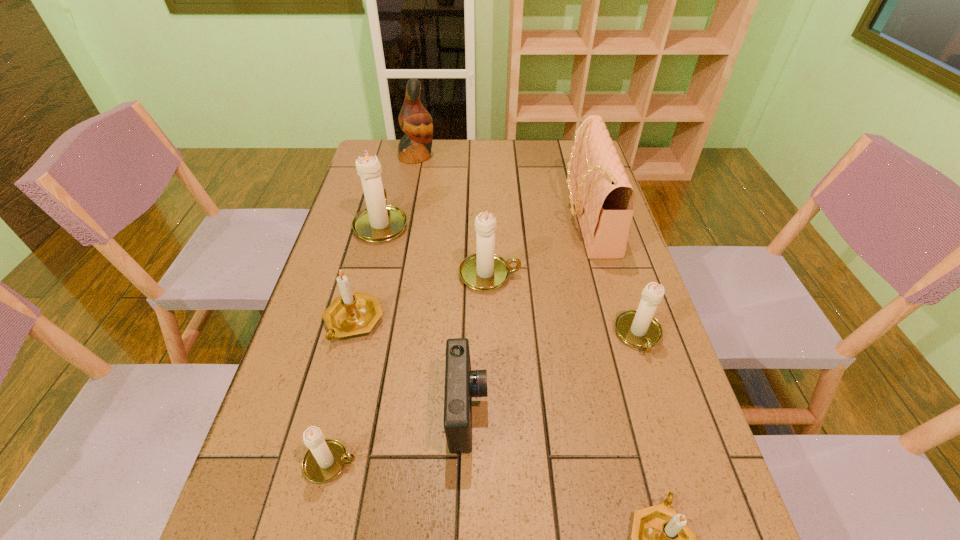
Find the location of a particular element. This screenshot has height=540, width=960. free region located on the front-facing side of the handbag is located at coordinates (497, 217).

Find the location of a particular element. The height and width of the screenshot is (540, 960). vacant space situated 0.120m on the handle side of the fourth candle holder from left to right is located at coordinates (564, 274).

You are a GUI agent. You are given a task and a screenshot of the screen. Output one action in this format:
    pyautogui.click(x=<x>, y=<y>)
    Task: Click on the vacant position located on the right of the bigger gold candle holder
    
    Given the screenshot: What is the action you would take?
    pyautogui.click(x=507, y=321)

Locate an element on the screen. vacant space located on the handle side of the second nearest white candle holder is located at coordinates (671, 440).

At what (x,y) coordinates should I click in order to perform the action: click on free spot located 0.060m on the front-facing side of the blue camera. Please return your answer as a coordinate pair (x, y). Looking at the image, I should click on (516, 410).

I want to click on free space located 0.240m on the handle side of the smallest white candle holder, so click(484, 463).

Where is `object located at the far edge`? The width and height of the screenshot is (960, 540). object located at the far edge is located at coordinates (415, 121).

Find the location of `parrot present at the left edge`. parrot present at the left edge is located at coordinates (415, 121).

Image resolution: width=960 pixels, height=540 pixels. In order to click on handbag that is positioned at the right edge in this screenshot , I will do `click(604, 199)`.

Find the location of a particular element. candle holder at the right edge is located at coordinates (638, 328).